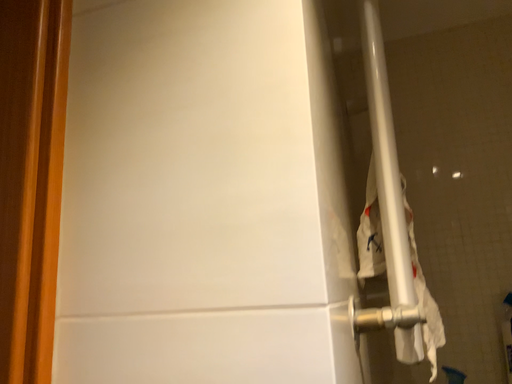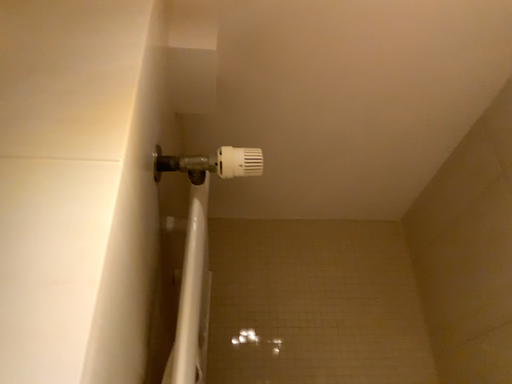
Question: Which way did the camera rotate in the video?

Choices:
 (A) rotated right
 (B) rotated left

Answer: (A)